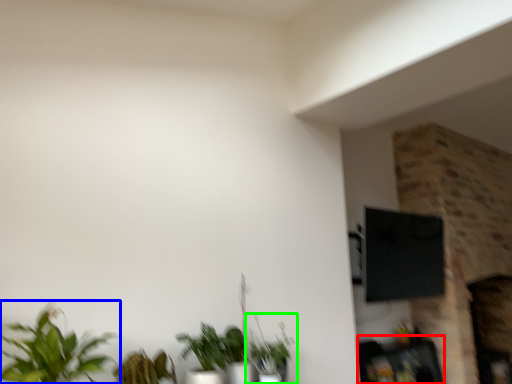
Question: Based on their relative distances, which object is farther from furniture (highlighted by a red box)? Choose from houseplant (highlighted by a blue box) and houseplant (highlighted by a green box).

Choices:
 (A) houseplant
 (B) houseplant

Answer: (A)